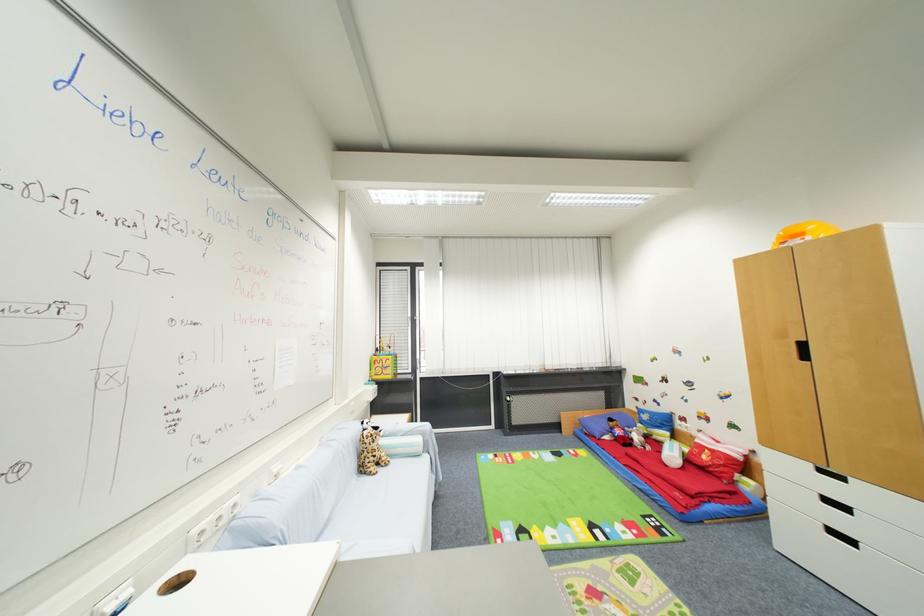
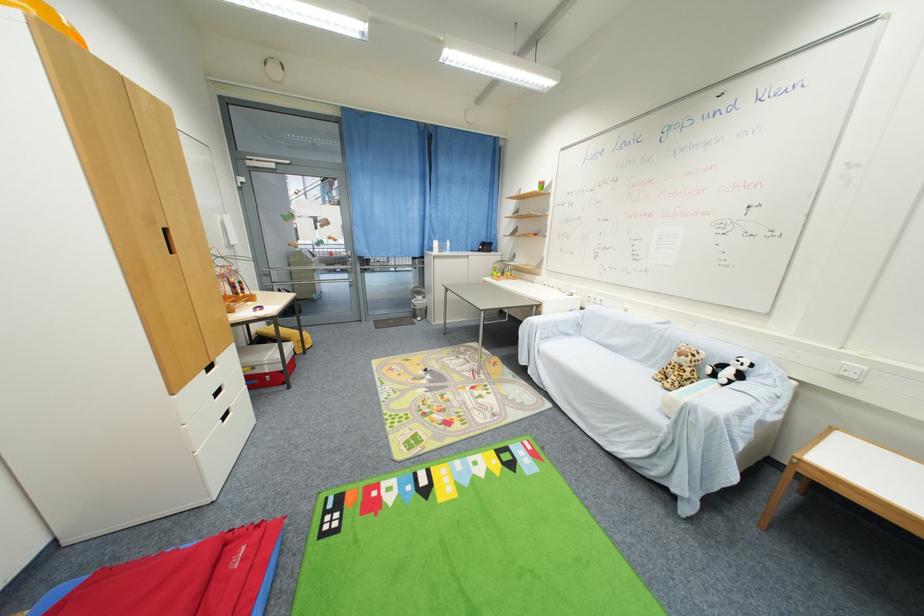
The point at (x=388, y=461) is marked in the first image. Where is the corresponding point in the second image?

(675, 382)